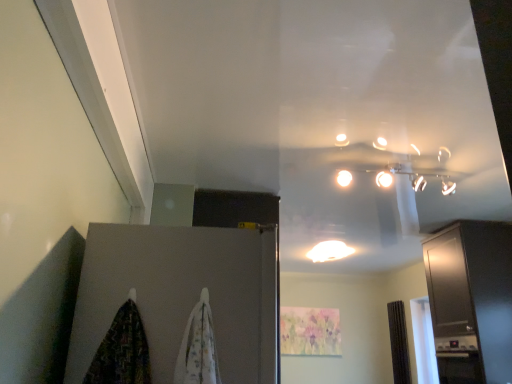
Question: From the image's perspective, relative to matte gray door at lower left, is satin black cabinet at right above or below?

Choices:
 (A) above
 (B) below

Answer: (B)

Question: Based on their positions, is satin black cabinet at right located to the left or right of matte gray door at lower left?

Choices:
 (A) right
 (B) left

Answer: (A)

Question: Which of these objects is positioned closest to the matte gray door at lower left?

Choices:
 (A) white fabric curtain at center, which is counted as the 2th curtain, starting from the back
 (B) brown textured curtain at right, acting as the first curtain starting from the bottom
 (C) white glossy light fixture at center
 (D) satin black cabinet at right

Answer: (A)

Question: Based on their relative distances, which object is farther from the brown textured curtain at right, the first curtain in the right-to-left sequence?

Choices:
 (A) white fabric curtain at center, marked as the 2th curtain in a right-to-left arrangement
 (B) satin black cabinet at right
 (C) matte gray door at lower left
 (D) white glossy light fixture at center

Answer: (A)